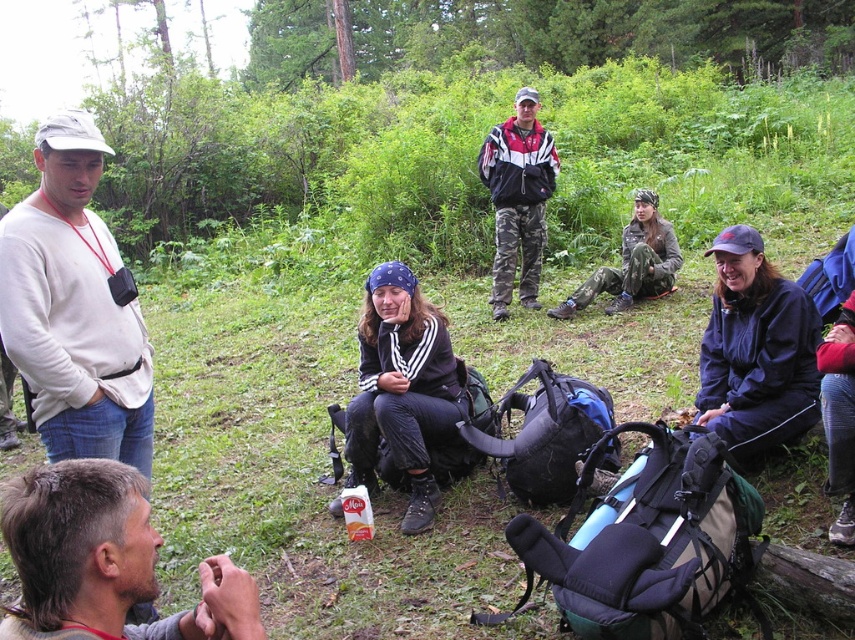
You are a photographer trying to capture a group photo of the people in the scene. You want to ensure that the brown hair at lower left and the camouflage pants at center are both clearly visible in the photo. Given their positions and heights, which one might need to be positioned closer to the camera to avoid being blocked by others?

The brown hair at lower left has a lesser height compared to camouflage pants at center, so the brown hair at lower left might need to be positioned closer to the camera to avoid being blocked by taller individuals behind it.

You are standing in the forest and see two points in the distance. The first point is at coordinates point (63, 468) and the second is at point (526, 184). Which point is closer to you?

Point (63, 468) is closer to the viewer than point (526, 184).

You are a photographer trying to capture a group photo of the scene. You notice the white matte shirt at left and the camouflage pants at center. Which clothing item should you focus on first to ensure it fits within the frame, considering their sizes?

The white matte shirt at left is smaller in size compared to the camouflage pants at center, so focusing on the camouflage pants at center first would ensure it fits within the frame due to its larger size.